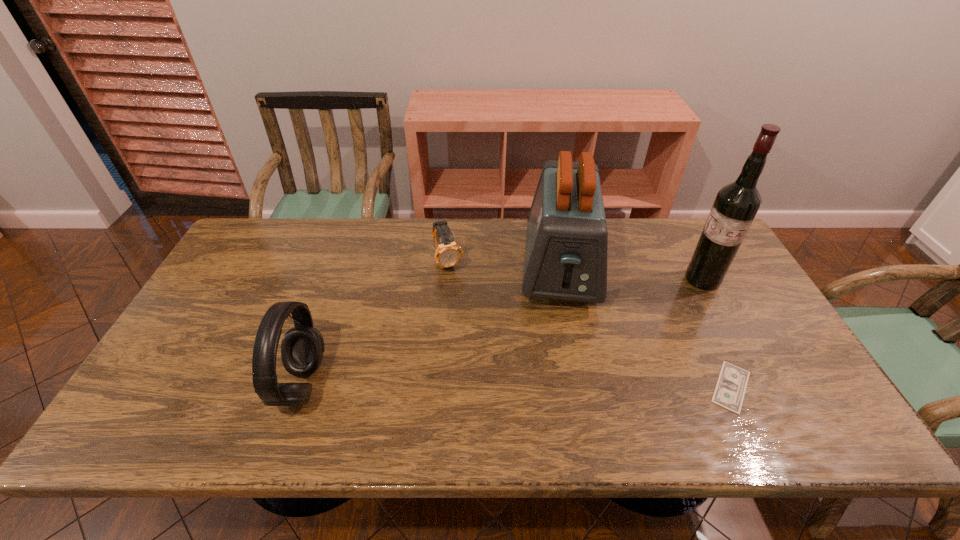
Image resolution: width=960 pixels, height=540 pixels. In order to click on toaster present at the far edge in this screenshot , I will do `click(566, 249)`.

Locate an element on the screen. headset that is at the near edge is located at coordinates (302, 347).

You are a GUI agent. You are given a task and a screenshot of the screen. Output one action in this format:
    pyautogui.click(x=<x>, y=<y>)
    Task: Click on the money that is at the near edge
    Image resolution: width=960 pixels, height=540 pixels.
    Given the screenshot: What is the action you would take?
    pyautogui.click(x=729, y=392)

You are a GUI agent. You are given a task and a screenshot of the screen. Output one action in this format:
    pyautogui.click(x=<x>, y=<y>)
    Task: Click on the money that is at the right edge
    This screenshot has height=540, width=960.
    Given the screenshot: What is the action you would take?
    pyautogui.click(x=729, y=392)

The image size is (960, 540). Find the location of `wine bottle located in the right edge section of the desktop`. wine bottle located in the right edge section of the desktop is located at coordinates (736, 205).

Find the location of a particular element. object that is at the near right corner is located at coordinates tap(729, 392).

In the image, there is a desktop. Where is `vacant space at the far edge`? The image size is (960, 540). vacant space at the far edge is located at coordinates (330, 218).

You are a GUI agent. You are given a task and a screenshot of the screen. Output one action in this format:
    pyautogui.click(x=<x>, y=<y>)
    Task: Click on the free space at the near edge of the desktop
    The height and width of the screenshot is (540, 960).
    Given the screenshot: What is the action you would take?
    pyautogui.click(x=493, y=399)

Identify the location of blank space at the right edge of the desktop. Image resolution: width=960 pixels, height=540 pixels. (754, 329).

Find the location of a particular element. vacant area at the far left corner of the desktop is located at coordinates 257,252.